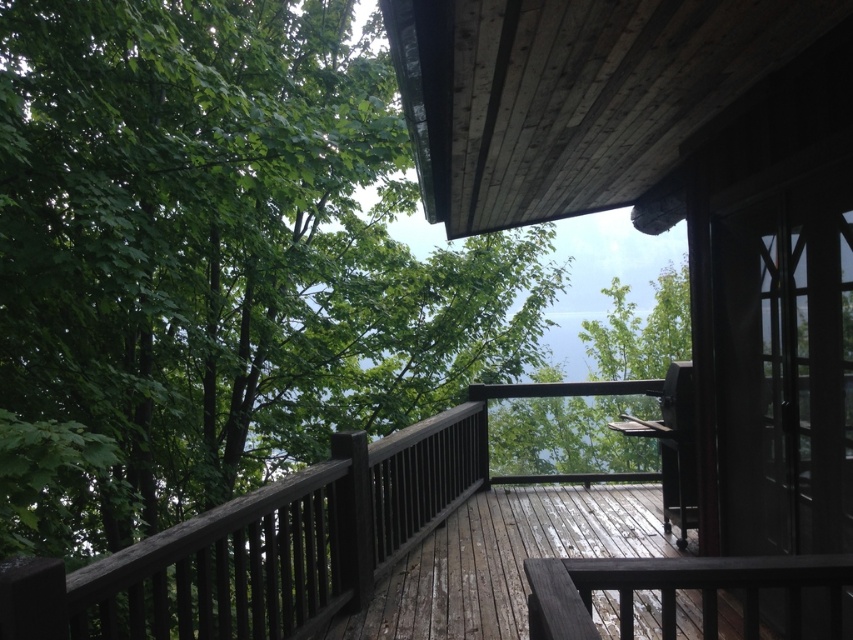
Question: Does green leafy tree at upper left come in front of weathered wood porch at center?

Choices:
 (A) no
 (B) yes

Answer: (A)

Question: Is the position of weathered wood porch at center less distant than that of green leafy tree at center?

Choices:
 (A) yes
 (B) no

Answer: (A)

Question: Which of the following is the closest to the observer?

Choices:
 (A) click(180, 300)
 (B) click(663, 330)
 (C) click(558, 614)
 (D) click(339, 449)

Answer: (C)

Question: Is green leafy tree at upper left to the left of green leafy tree at center from the viewer's perspective?

Choices:
 (A) no
 (B) yes

Answer: (B)

Question: Which object is farther from the camera taking this photo?

Choices:
 (A) green leafy tree at center
 (B) weathered wood porch at center
 (C) green leafy tree at upper left

Answer: (A)

Question: Among these objects, which one is farthest from the camera?

Choices:
 (A) weathered wood porch at center
 (B) dark brown wood balustrade at lower right

Answer: (A)